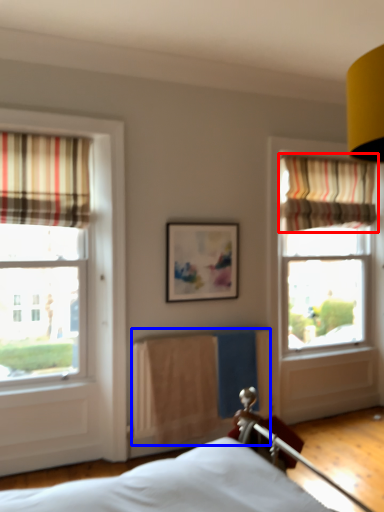
Question: Which of the following is the closest to the observer, curtain (highlighted by a red box) or radiator (highlighted by a blue box)?

Choices:
 (A) curtain
 (B) radiator

Answer: (B)